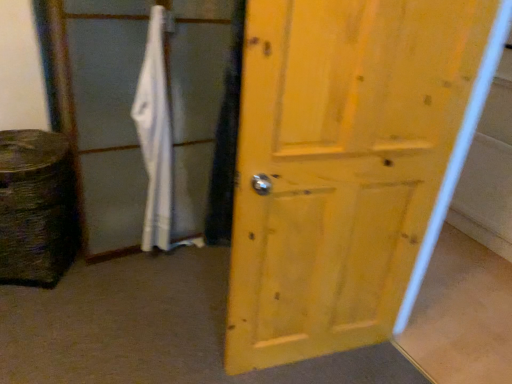
What is the approximate width of yellow wood door at center?

The width of yellow wood door at center is 4.70 inches.

Measure the distance between white fabric bath towel at center-left and camera.

The depth of white fabric bath towel at center-left is 1.74 meters.

Locate an element on the screen. yellow wood door at center is located at coordinates (348, 165).

Is matte white screen door at center turned away from yellow wood door at center?

matte white screen door at center is not turned away from yellow wood door at center.

Is point (85, 143) closer or farther from the camera than point (273, 246)?

Point (85, 143) appears to be farther away from the viewer than point (273, 246).

Is matte white screen door at center bigger than yellow wood door at center?

Yes.

I want to click on screen door above the yellow wood door at center (from the image's perspective), so (106, 118).

From a real-world perspective, is matte white screen door at center positioned over white fabric bath towel at center-left based on gravity?

Correct, in the physical world, matte white screen door at center is higher than white fabric bath towel at center-left.

From the image's perspective, between matte white screen door at center and white fabric bath towel at center-left, which one is located above?

matte white screen door at center appears higher in the image.

Is white fabric bath towel at center-left a part of matte white screen door at center?

Yes, white fabric bath towel at center-left is a part of matte white screen door at center.

Based on the photo, which of these two, matte white screen door at center or white fabric bath towel at center-left, is smaller?

white fabric bath towel at center-left is smaller.

Is yellow wood door at center to the right of matte white screen door at center from the viewer's perspective?

Yes.

What's the angular difference between yellow wood door at center and matte white screen door at center's facing directions?

12.3 degrees.

Based on their sizes in the image, would you say yellow wood door at center is bigger or smaller than matte white screen door at center?

yellow wood door at center is smaller than matte white screen door at center.

The width and height of the screenshot is (512, 384). Find the location of `door that is on the right side of matte white screen door at center`. door that is on the right side of matte white screen door at center is located at coordinates (348, 165).

Does yellow wood door at center come in front of white fabric bath towel at center-left?

That is True.

Where is `door below the white fabric bath towel at center-left (from the image's perspective)`? The width and height of the screenshot is (512, 384). door below the white fabric bath towel at center-left (from the image's perspective) is located at coordinates (348, 165).

Would you say yellow wood door at center is outside white fabric bath towel at center-left?

Yes.

Who is taller, yellow wood door at center or white fabric bath towel at center-left?

yellow wood door at center.

Considering the relative sizes of white fabric bath towel at center-left and matte white screen door at center in the image provided, is white fabric bath towel at center-left taller than matte white screen door at center?

Incorrect, the height of white fabric bath towel at center-left is not larger of that of matte white screen door at center.

In the scene shown: Does white fabric bath towel at center-left turn towards matte white screen door at center?

Yes, white fabric bath towel at center-left is oriented towards matte white screen door at center.

Can we say white fabric bath towel at center-left lies outside matte white screen door at center?

No, white fabric bath towel at center-left is not outside of matte white screen door at center.

Which object is closer to the camera taking this photo, white fabric bath towel at center-left or yellow wood door at center?

yellow wood door at center is more forward.

From the image's perspective, which is above, white fabric bath towel at center-left or yellow wood door at center?

white fabric bath towel at center-left.

Is white fabric bath towel at center-left next to yellow wood door at center?

No, white fabric bath towel at center-left is not beside yellow wood door at center.

Find the location of a particular element. This screenshot has height=384, width=512. screen door behind the yellow wood door at center is located at coordinates (106, 118).

You are a GUI agent. You are given a task and a screenshot of the screen. Output one action in this format:
    pyautogui.click(x=<x>, y=<y>)
    Task: Click on the bath towel located underneath the matte white screen door at center (from a real-world perspective)
    Image resolution: width=512 pixels, height=384 pixels.
    Given the screenshot: What is the action you would take?
    pyautogui.click(x=155, y=135)

From the image, which object appears to be farther from matte white screen door at center, white fabric bath towel at center-left or yellow wood door at center?

Among the two, yellow wood door at center is located further to matte white screen door at center.

Based on their spatial positions, is yellow wood door at center or matte white screen door at center closer to white fabric bath towel at center-left?

The object closer to white fabric bath towel at center-left is matte white screen door at center.

When comparing their distances from white fabric bath towel at center-left, does matte white screen door at center or yellow wood door at center seem closer?

The object closer to white fabric bath towel at center-left is matte white screen door at center.

When comparing their distances from yellow wood door at center, does matte white screen door at center or white fabric bath towel at center-left seem closer?

matte white screen door at center is positioned closer to the anchor yellow wood door at center.

From the image, which object appears to be nearer to matte white screen door at center, yellow wood door at center or white fabric bath towel at center-left?

Based on the image, white fabric bath towel at center-left appears to be nearer to matte white screen door at center.

Estimate the real-world distances between objects in this image. Which object is closer to yellow wood door at center, white fabric bath towel at center-left or matte white screen door at center?

Based on the image, matte white screen door at center appears to be nearer to yellow wood door at center.

Find the location of a particular element. bath towel situated between matte white screen door at center and yellow wood door at center from left to right is located at coordinates (155, 135).